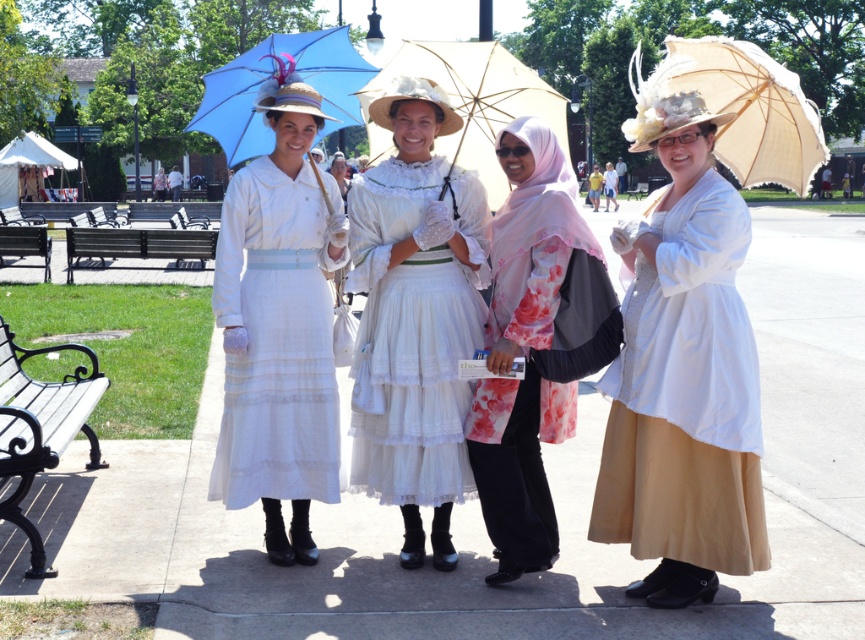
Question: Which point is closer to the camera?

Choices:
 (A) (485, 440)
 (B) (478, 70)
 (C) (43, 422)
 (D) (48, 269)

Answer: (A)

Question: Based on their relative distances, which object is farther from the black wrought iron bench at lower left?

Choices:
 (A) matte white dress at center
 (B) beige lace parasol at upper right
 (C) white lace dress at center
 (D) matte blue fabric umbrella at upper left

Answer: (B)

Question: Can you confirm if smooth concrete sidewalk at center is positioned above pink floral fabric hijab at center?

Choices:
 (A) yes
 (B) no

Answer: (A)

Question: Does matte white blouse at center have a larger size compared to white lace dress at center?

Choices:
 (A) yes
 (B) no

Answer: (A)

Question: Which of the following is the farthest from the observer?

Choices:
 (A) (138, 248)
 (B) (225, 440)
 (C) (723, 131)
 (D) (561, 134)

Answer: (A)

Question: Can you confirm if smooth concrete sidewalk at center is positioned to the right of pink floral fabric hijab at center?

Choices:
 (A) no
 (B) yes

Answer: (A)